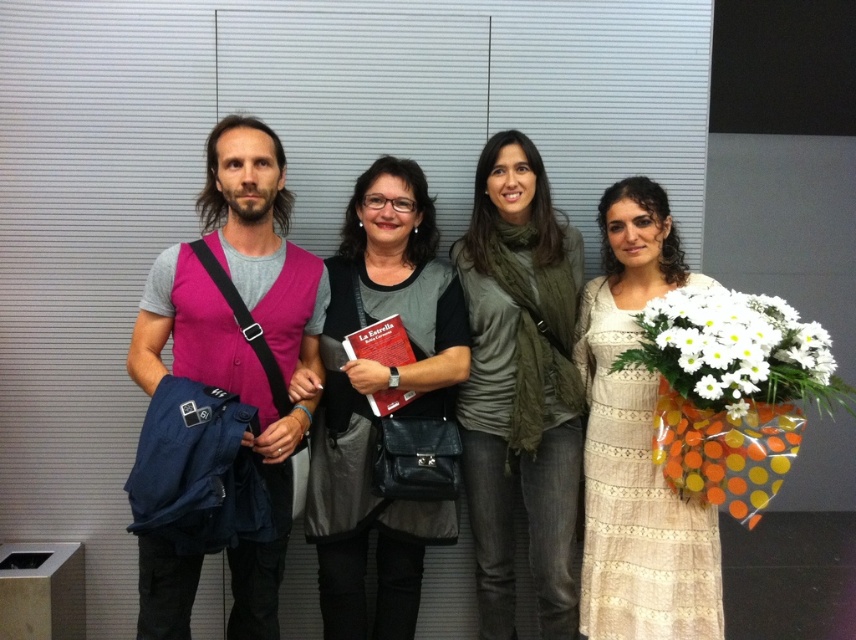
You are standing in front of the group of four individuals posing for a photograph. You notice the green matte scarf at center. Which person is wearing it?

The green matte scarf at center is located at point [520,387], which corresponds to the first woman from the left who is wearing a black top with a gray.

Based on the scene description, which object is positioned to the left of the other between the green matte scarf at center and the matte black book at center?

A: The matte black book at center is positioned to the left of the green matte scarf at center.

You are a photographer standing at the camera position. You want to adjust your zoom lens to focus on the green matte scarf at center. What is the approximate distance you need to set your focus to?

The green matte scarf at center is 2.32 meters away from the camera, so you should set the focus distance to approximately 2.32 meters.